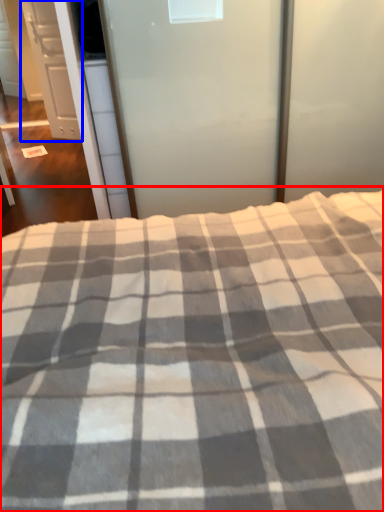
Question: Which point is further to the camera, bed (highlighted by a red box) or cabinetry (highlighted by a blue box)?

Choices:
 (A) bed
 (B) cabinetry

Answer: (B)